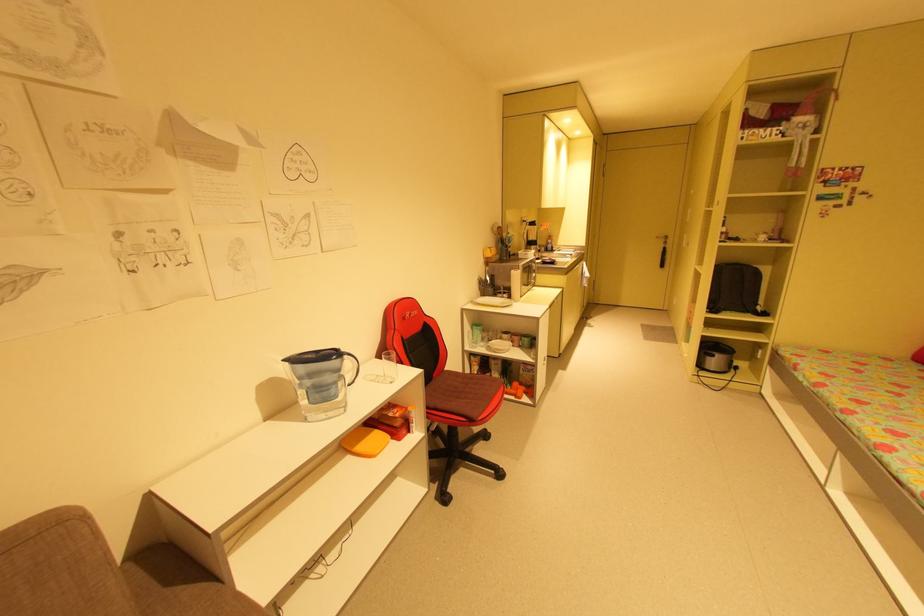
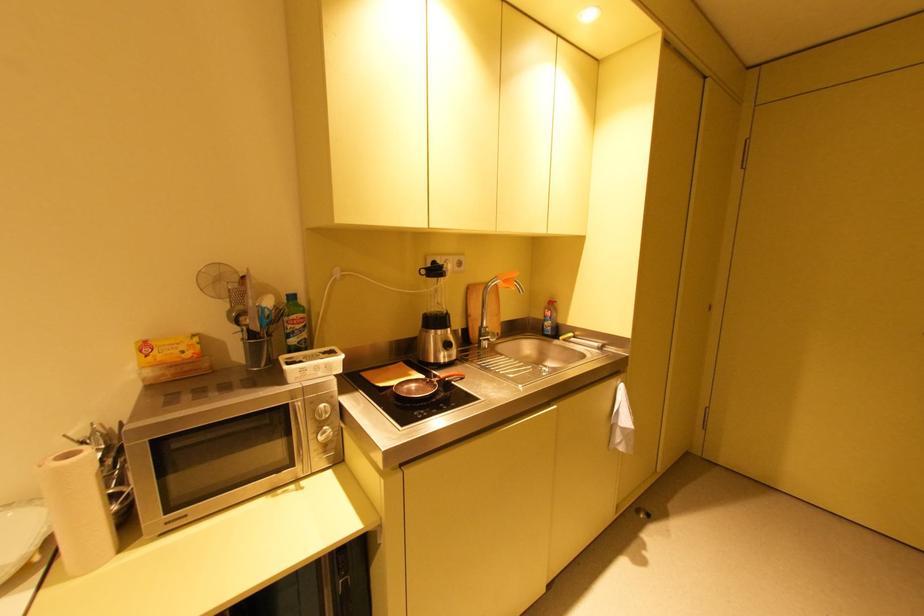
In a continuous first-person perspective shot, in which direction is the camera moving?

The movement direction of the cameraman is right, forward.